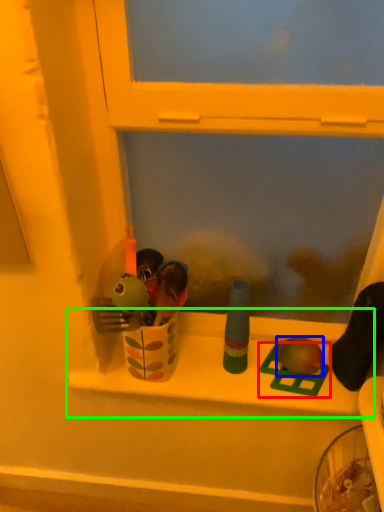
Question: Which object is positioned closest to toy (highlighted by a red box)? Select from toy (highlighted by a blue box) and window sill (highlighted by a green box).

Choices:
 (A) toy
 (B) window sill

Answer: (A)